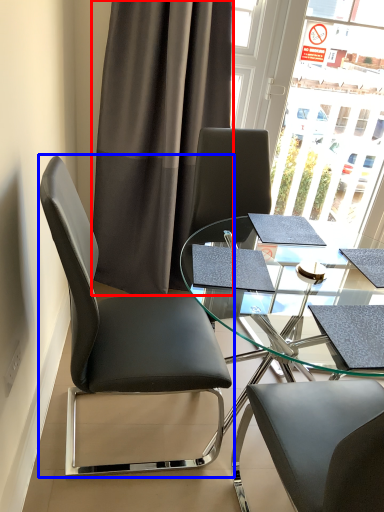
Question: Which object is further to the camera taking this photo, curtain (highlighted by a red box) or chair (highlighted by a blue box)?

Choices:
 (A) curtain
 (B) chair

Answer: (A)